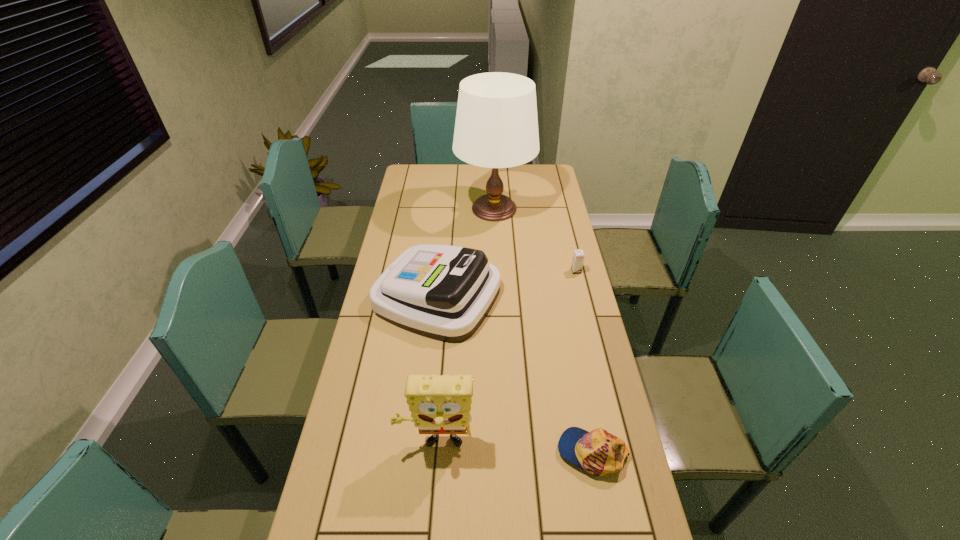
You are a GUI agent. You are given a task and a screenshot of the screen. Output one action in this format:
    pyautogui.click(x=<x>, y=<y>)
    Task: Click on the tallest object
    This screenshot has width=960, height=540.
    Given the screenshot: What is the action you would take?
    pyautogui.click(x=496, y=126)

I want to click on lamp, so click(496, 126).

The height and width of the screenshot is (540, 960). Find the location of `the second tallest object`. the second tallest object is located at coordinates point(441,404).

The width and height of the screenshot is (960, 540). In order to click on the third shortest object in this screenshot , I will do `click(442, 292)`.

Where is `chocolate milk`? The image size is (960, 540). chocolate milk is located at coordinates (578, 256).

At what (x,y) coordinates should I click in order to perform the action: click on the shortest object. Please return your answer as a coordinate pair (x, y). Image resolution: width=960 pixels, height=540 pixels. Looking at the image, I should click on (598, 452).

Find the location of `vacant region located 0.250m on the front of the tallest object`. vacant region located 0.250m on the front of the tallest object is located at coordinates (497, 271).

The image size is (960, 540). What are the coordinates of `vacant space situated on the face of the sponge` in the screenshot? It's located at (433, 482).

Image resolution: width=960 pixels, height=540 pixels. I want to click on free location located 0.330m on the front of the cash register, so click(422, 439).

You are a GUI agent. You are given a task and a screenshot of the screen. Output one action in this format:
    pyautogui.click(x=<x>, y=<y>)
    Task: Click on the vacant space situated on the left of the chocolate milk
    Image resolution: width=960 pixels, height=540 pixels.
    Given the screenshot: What is the action you would take?
    pyautogui.click(x=553, y=272)